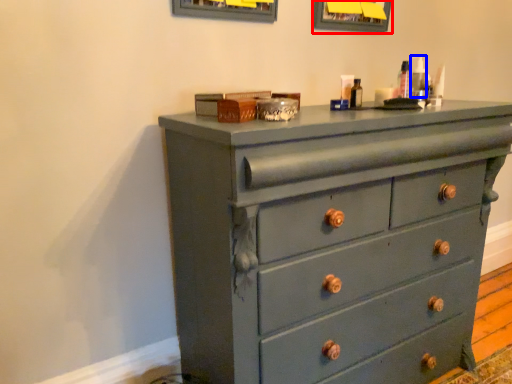
Question: Which of the following is the farthest to the observer, picture frame (highlighted by a red box) or toiletry (highlighted by a blue box)?

Choices:
 (A) picture frame
 (B) toiletry

Answer: (A)